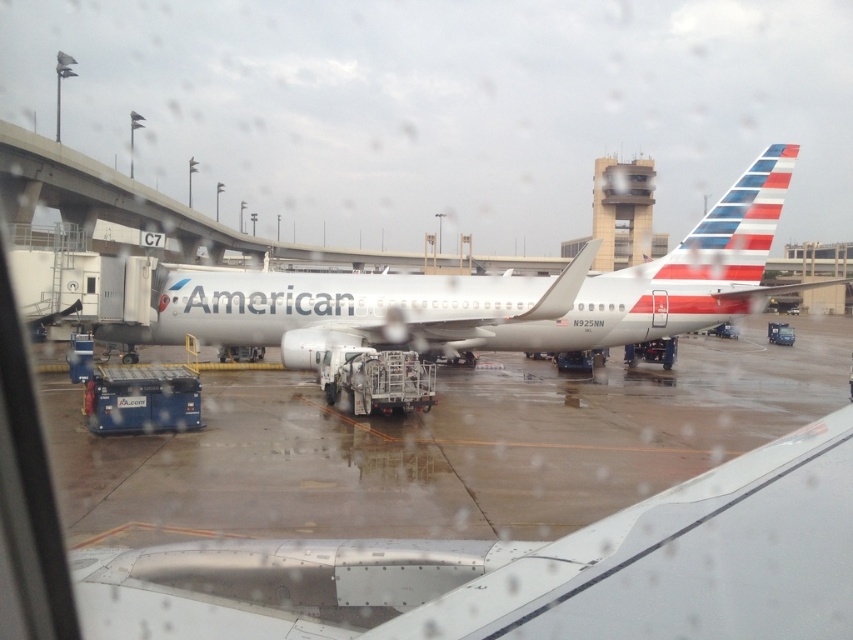
Is silver metallic winglet at lower center closer to camera compared to white glossy airplane at center?

Yes, silver metallic winglet at lower center is closer to the viewer.

Is silver metallic winglet at lower center wider than white glossy airplane at center?

In fact, silver metallic winglet at lower center might be narrower than white glossy airplane at center.

What do you see at coordinates (527, 570) in the screenshot?
I see `silver metallic winglet at lower center` at bounding box center [527, 570].

Where is `silver metallic winglet at lower center`? Image resolution: width=853 pixels, height=640 pixels. silver metallic winglet at lower center is located at coordinates (527, 570).